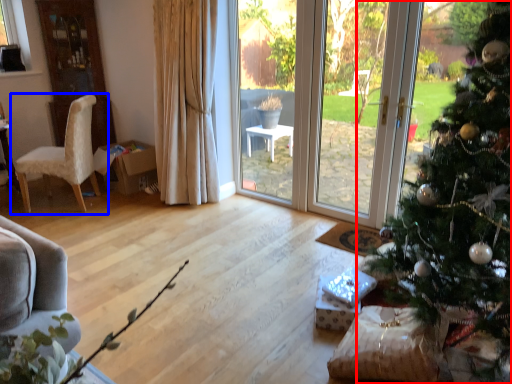
Question: Which of the following is the closest to the observer, christmas tree (highlighted by a red box) or chair (highlighted by a blue box)?

Choices:
 (A) christmas tree
 (B) chair

Answer: (A)